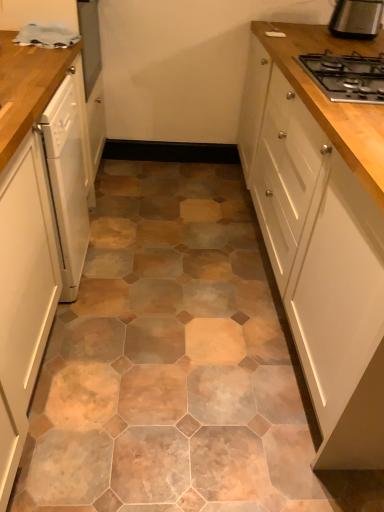
You are a GUI agent. You are given a task and a screenshot of the screen. Output one action in this format:
    pyautogui.click(x=<x>, y=<y>)
    Task: Click on the vacant area that is in front of black metallic toaster at upper right
    
    Given the screenshot: What is the action you would take?
    pyautogui.click(x=353, y=40)